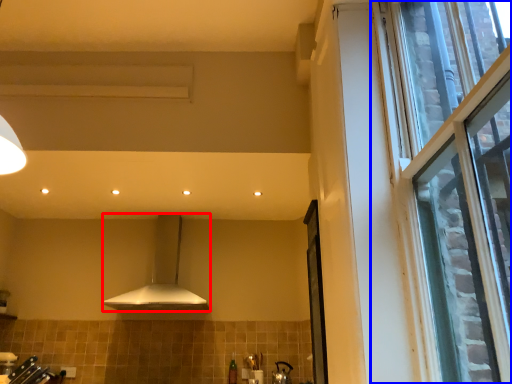
Question: Among these objects, which one is farthest to the camera, kitchen appliance (highlighted by a red box) or window (highlighted by a blue box)?

Choices:
 (A) kitchen appliance
 (B) window

Answer: (A)